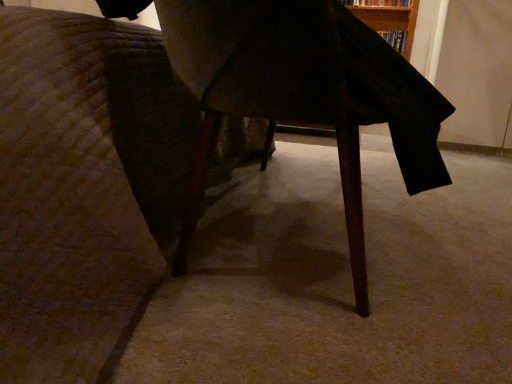
Question: Considering the positions of wooden table at center and hardcover book at upper right in the image, is wooden table at center wider or thinner than hardcover book at upper right?

Choices:
 (A) thin
 (B) wide

Answer: (B)

Question: Based on their sizes in the image, would you say wooden table at center is bigger or smaller than hardcover book at upper right?

Choices:
 (A) big
 (B) small

Answer: (A)

Question: Which of these objects is positioned closest to the wooden table at center?

Choices:
 (A) hardcover book at upper right
 (B) wooden table at center

Answer: (B)

Question: Estimate the real-world distances between objects in this image. Which object is farther from the wooden table at center?

Choices:
 (A) hardcover book at upper right
 (B) wooden table at center

Answer: (A)